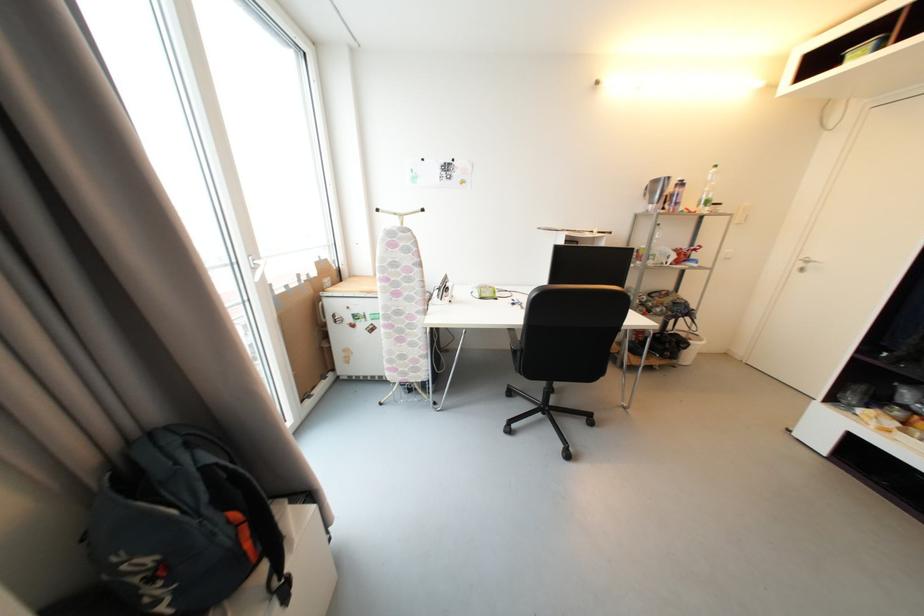
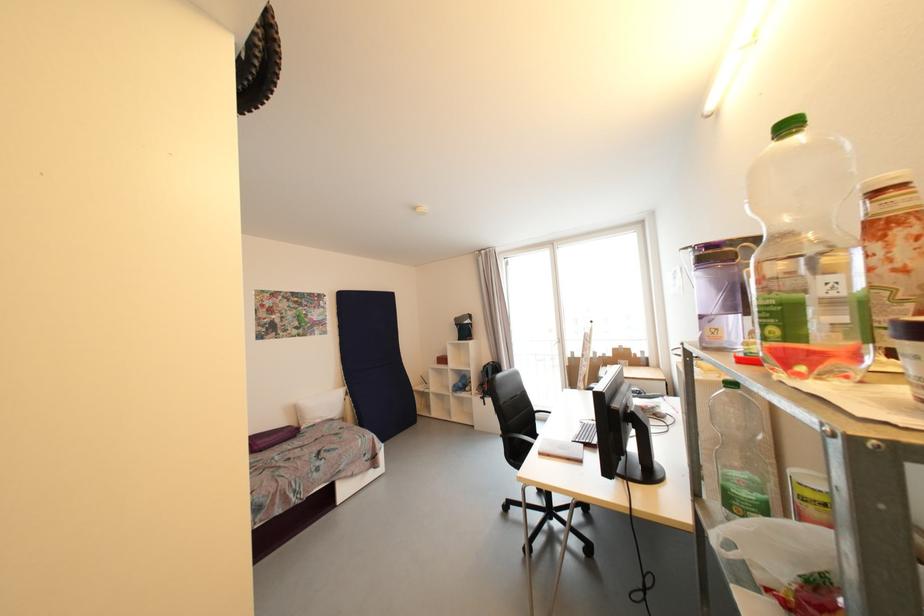
In the second image, find the point that corresponds to point (516, 331) in the first image.

(554, 411)